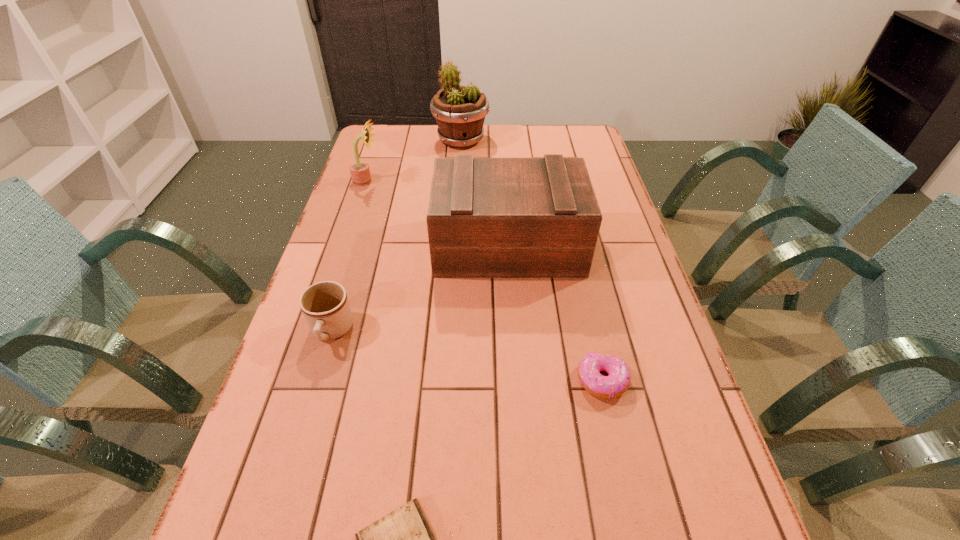
You are a GUI agent. You are given a task and a screenshot of the screen. Output one action in this format:
    pyautogui.click(x=<x>, y=<y>)
    Task: Click on the vacant region at the right edge of the desktop
    The width and height of the screenshot is (960, 540).
    Given the screenshot: What is the action you would take?
    pyautogui.click(x=637, y=436)

You are a GUI agent. You are given a task and a screenshot of the screen. Output one action in this format:
    pyautogui.click(x=<x>, y=<y>)
    Task: Click on the free region at the far left corner of the desktop
    
    Given the screenshot: What is the action you would take?
    pyautogui.click(x=378, y=138)

Where is `vacant space that is in between the second farthest object and the tallest object`? The width and height of the screenshot is (960, 540). vacant space that is in between the second farthest object and the tallest object is located at coordinates (414, 161).

The height and width of the screenshot is (540, 960). What are the coordinates of `free point between the farthest object and the sunflower` in the screenshot? It's located at (414, 161).

You are a GUI agent. You are given a task and a screenshot of the screen. Output one action in this format:
    pyautogui.click(x=<x>, y=<y>)
    Task: Click on the free point between the doughnut and the third farthest object
    
    Given the screenshot: What is the action you would take?
    pyautogui.click(x=555, y=313)

The width and height of the screenshot is (960, 540). What are the coordinates of `object that can be found as the fifth closest to the third farthest object` in the screenshot? It's located at (403, 539).

Identify which object is the fifth nearest to the sunflower. Please provide its 2D coordinates. Your answer should be formatted as a tuple, i.e. [(x, y)], where the tuple contains the x and y coordinates of a point satisfying the conditions above.

[(403, 539)]

This screenshot has height=540, width=960. I want to click on vacant position in the image that satisfies the following two spatial constraints: 1. on the face of the fifth nearest object; 2. on the left side of the fourth nearest object, so click(x=346, y=246).

This screenshot has height=540, width=960. Find the location of `vacant space that satisfies the following two spatial constraints: 1. on the face of the doughnut; 2. on the right side of the fifth nearest object`. vacant space that satisfies the following two spatial constraints: 1. on the face of the doughnut; 2. on the right side of the fifth nearest object is located at coordinates (300, 381).